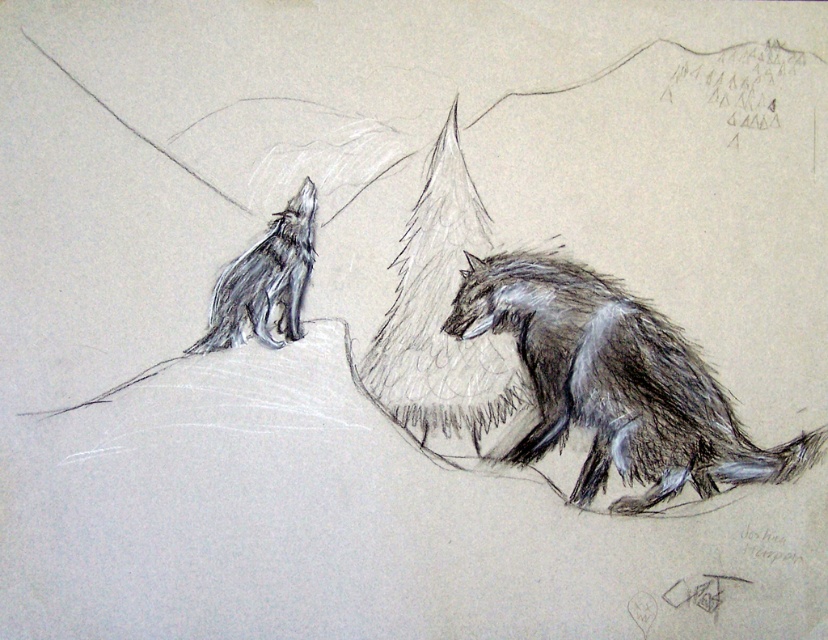
Between shaggy fur coyote at right and shaggy fur wolf at upper left, which one appears on the right side from the viewer's perspective?

shaggy fur coyote at right is more to the right.

Describe the element at coordinates (615, 381) in the screenshot. This screenshot has height=640, width=828. I see `shaggy fur coyote at right` at that location.

Locate an element on the screen. The image size is (828, 640). shaggy fur coyote at right is located at coordinates (615, 381).